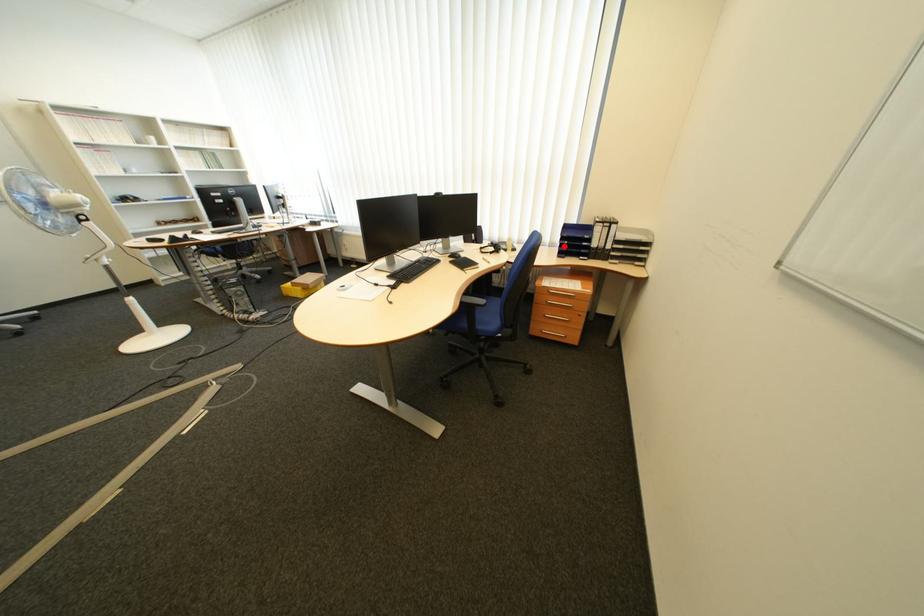
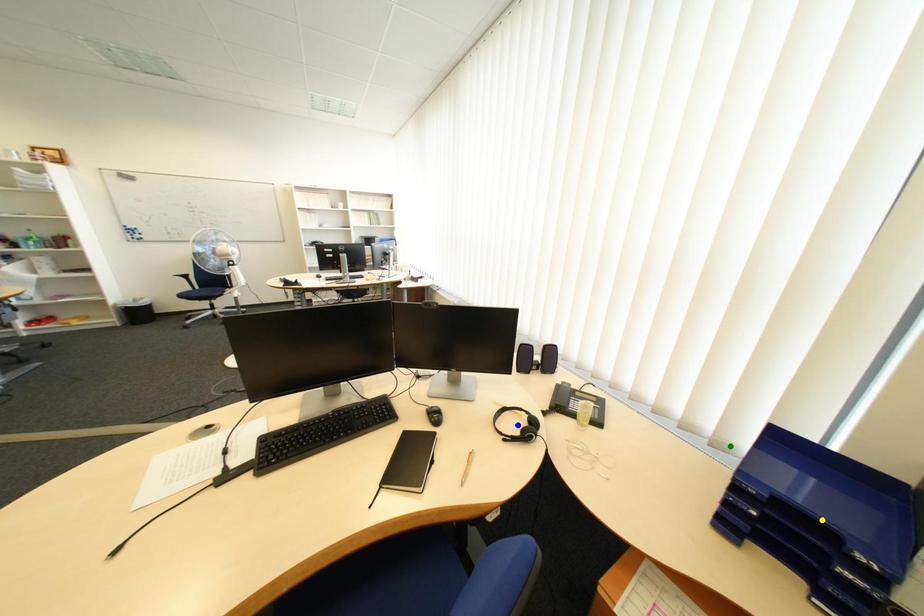
Question: I am providing you with two images of the same scene from different viewpoints. A red point is marked on the first image. You are given multiple points on the second image. In image 2, which mark is for the same physical point as the one in image 1?

Choices:
 (A) green point
 (B) yellow point
 (C) blue point

Answer: (A)